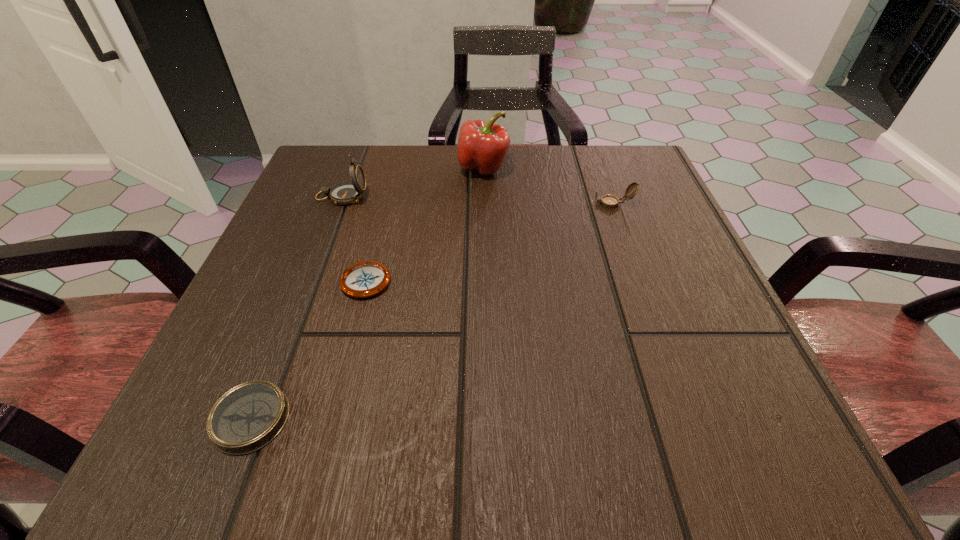
Image resolution: width=960 pixels, height=540 pixels. Find the location of `empty space that is in between the tallest compass and the third tallest object`. empty space that is in between the tallest compass and the third tallest object is located at coordinates (x=477, y=200).

Locate an element on the screen. This screenshot has width=960, height=540. free area in between the rightmost compass and the fourth object from left to right is located at coordinates (548, 186).

You are a GUI agent. You are given a task and a screenshot of the screen. Output one action in this format:
    pyautogui.click(x=<x>, y=<y>)
    Task: Click on the vacant area that lies between the fourth object from left to right and the third object from left to right
    The image size is (960, 540).
    Given the screenshot: What is the action you would take?
    pyautogui.click(x=425, y=224)

This screenshot has height=540, width=960. Find the location of `empty location between the rightmost compass and the fourth farthest object`. empty location between the rightmost compass and the fourth farthest object is located at coordinates (490, 242).

Identify the location of object that is the third nearest to the nearest object. (482, 147).

You are a GUI agent. You are given a task and a screenshot of the screen. Output one action in this format:
    pyautogui.click(x=<x>, y=<y>)
    Task: Click on the object identified as the fourth closest to the fourth object from left to right
    This screenshot has width=960, height=540.
    Given the screenshot: What is the action you would take?
    pyautogui.click(x=246, y=418)

Locate which compass is the third closest to the rightmost object. Please provide its 2D coordinates. Your answer should be formatted as a tuple, i.e. [(x, y)], where the tuple contains the x and y coordinates of a point satisfying the conditions above.

[(246, 418)]

Where is `the third closest compass to the nearest object`? the third closest compass to the nearest object is located at coordinates [608, 201].

You are a GUI agent. You are given a task and a screenshot of the screen. Output one action in this format:
    pyautogui.click(x=<x>, y=<y>)
    Task: Click on the vacant area in the image that satisfies the following two spatial constraints: 1. on the back side of the pepper; 2. on the right side of the fourth farthest object
    This screenshot has height=540, width=960.
    Given the screenshot: What is the action you would take?
    pyautogui.click(x=396, y=168)

Image resolution: width=960 pixels, height=540 pixels. I want to click on vacant region that satisfies the following two spatial constraints: 1. on the face of the fourth shortest object; 2. on the front side of the nearest compass, so click(256, 418).